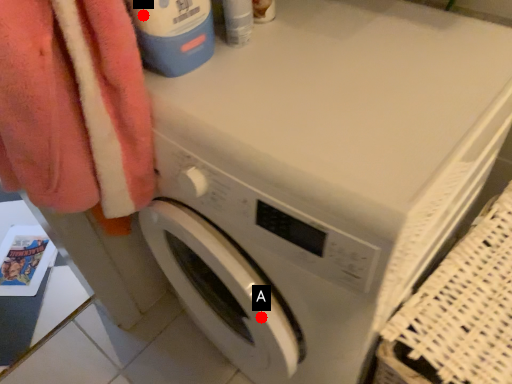
Question: Two points are circled on the image, labeled by A and B beside each circle. Which point is further to the camera?

Choices:
 (A) A is further
 (B) B is further

Answer: (A)